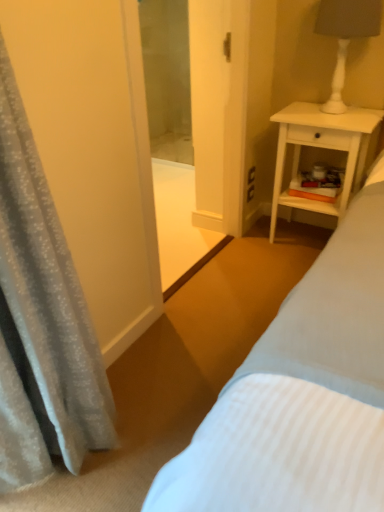
What do you see at coordinates (345, 36) in the screenshot? The image size is (384, 512). I see `white matte lamp at upper right` at bounding box center [345, 36].

What is the approximate height of silky gray curtain at left?

The height of silky gray curtain at left is 3.96 feet.

Locate an element on the screen. The width and height of the screenshot is (384, 512). transparent glass screen door at center is located at coordinates (218, 112).

Image resolution: width=384 pixels, height=512 pixels. I want to click on white wood nightstand at right, so click(x=322, y=148).

This screenshot has width=384, height=512. What do you see at coordinates (322, 148) in the screenshot?
I see `white wood nightstand at right` at bounding box center [322, 148].

The image size is (384, 512). I want to click on white matte lamp at upper right, so click(x=345, y=36).

Is transparent glass screen door at center next to white matte lamp at upper right and touching it?

No, transparent glass screen door at center is not next to white matte lamp at upper right.

Where is `bedside lamp behind the transparent glass screen door at center`? Image resolution: width=384 pixels, height=512 pixels. bedside lamp behind the transparent glass screen door at center is located at coordinates (345, 36).

From the image's perspective, which is above, transparent glass screen door at center or white matte lamp at upper right?

white matte lamp at upper right appears higher in the image.

From a real-world perspective, is silky gray curtain at left physically located above or below white matte lamp at upper right?

silky gray curtain at left is below white matte lamp at upper right.

Could you tell me if silky gray curtain at left is facing white matte lamp at upper right?

No, silky gray curtain at left is not aimed at white matte lamp at upper right.

Is silky gray curtain at left to the left of white matte lamp at upper right from the viewer's perspective?

Yes.

Is silky gray curtain at left taller or shorter than white matte lamp at upper right?

silky gray curtain at left is taller than white matte lamp at upper right.

Considering the positions of objects white wood nightstand at right and silky gray curtain at left in the image provided, who is more to the left, white wood nightstand at right or silky gray curtain at left?

Positioned to the left is silky gray curtain at left.

From the image's perspective, between white wood nightstand at right and silky gray curtain at left, which one is located above?

From the image's view, white wood nightstand at right is above.

Is white wood nightstand at right oriented towards silky gray curtain at left?

Yes, white wood nightstand at right is oriented towards silky gray curtain at left.

At what (x,y) coordinates should I click in order to perform the action: click on bedside lamp that is on the right side of transparent glass screen door at center. Please return your answer as a coordinate pair (x, y). The height and width of the screenshot is (512, 384). Looking at the image, I should click on (345, 36).

Can you confirm if white matte lamp at upper right is positioned to the right of transparent glass screen door at center?

Yes.

Is point (381, 9) more distant than point (238, 141)?

No, (381, 9) is closer to viewer.

Between white matte lamp at upper right and transparent glass screen door at center, which one has more height?

transparent glass screen door at center.

Considering the relative positions of silky gray curtain at left and transparent glass screen door at center in the image provided, is silky gray curtain at left to the left or to the right of transparent glass screen door at center?

Based on their positions, silky gray curtain at left is located to the left of transparent glass screen door at center.

Does silky gray curtain at left turn towards transparent glass screen door at center?

No.

The width and height of the screenshot is (384, 512). I want to click on screen door located above the silky gray curtain at left (from the image's perspective), so click(x=218, y=112).

Is silky gray curtain at left smaller than transparent glass screen door at center?

Actually, silky gray curtain at left might be larger than transparent glass screen door at center.

Can you confirm if transparent glass screen door at center is smaller than silky gray curtain at left?

Correct, transparent glass screen door at center occupies less space than silky gray curtain at left.

Is transparent glass screen door at center touching silky gray curtain at left?

No, transparent glass screen door at center is not beside silky gray curtain at left.

Can you tell me how much transparent glass screen door at center and silky gray curtain at left differ in facing direction?

The facing directions of transparent glass screen door at center and silky gray curtain at left are 3.49 degrees apart.

Considering the relative positions of white matte lamp at upper right and white wood nightstand at right in the image provided, is white matte lamp at upper right in front of white wood nightstand at right?

Yes, it is.

From a real-world perspective, is white matte lamp at upper right over white wood nightstand at right?

Correct, in the physical world, white matte lamp at upper right is higher than white wood nightstand at right.

Which is behind, point (371, 13) or point (278, 146)?

Positioned behind is point (278, 146).

In terms of size, does white matte lamp at upper right appear bigger or smaller than white wood nightstand at right?

Considering their sizes, white matte lamp at upper right takes up less space than white wood nightstand at right.

Where is `screen door below the white matte lamp at upper right (from a real-world perspective)`? screen door below the white matte lamp at upper right (from a real-world perspective) is located at coordinates (218, 112).

Image resolution: width=384 pixels, height=512 pixels. Find the location of `curtain in front of the white matte lamp at upper right`. curtain in front of the white matte lamp at upper right is located at coordinates (41, 320).

Considering their positions, is white matte lamp at upper right positioned closer to silky gray curtain at left than transparent glass screen door at center?

Based on the image, transparent glass screen door at center appears to be nearer to silky gray curtain at left.

From the image, which object appears to be nearer to white wood nightstand at right, transparent glass screen door at center or silky gray curtain at left?

Among the two, transparent glass screen door at center is located nearer to white wood nightstand at right.

Based on their spatial positions, is silky gray curtain at left or transparent glass screen door at center further from white wood nightstand at right?

The object further to white wood nightstand at right is silky gray curtain at left.

Based on their spatial positions, is white matte lamp at upper right or white wood nightstand at right further from silky gray curtain at left?

white matte lamp at upper right lies further to silky gray curtain at left than the other object.

Which object lies nearer to the anchor point transparent glass screen door at center, white wood nightstand at right or silky gray curtain at left?

Based on the image, white wood nightstand at right appears to be nearer to transparent glass screen door at center.

From the image, which object appears to be farther from white matte lamp at upper right, white wood nightstand at right or silky gray curtain at left?

silky gray curtain at left.

Considering their positions, is silky gray curtain at left positioned further to transparent glass screen door at center than white matte lamp at upper right?

silky gray curtain at left lies further to transparent glass screen door at center than the other object.

Which object lies nearer to the anchor point white matte lamp at upper right, transparent glass screen door at center or white wood nightstand at right?

Based on the image, white wood nightstand at right appears to be nearer to white matte lamp at upper right.

The height and width of the screenshot is (512, 384). I want to click on screen door between silky gray curtain at left and white wood nightstand at right from front to back, so click(x=218, y=112).

At what (x,y) coordinates should I click in order to perform the action: click on bedside lamp located between silky gray curtain at left and white wood nightstand at right in the depth direction. Please return your answer as a coordinate pair (x, y). Looking at the image, I should click on (345, 36).

This screenshot has width=384, height=512. I want to click on nightstand situated between transparent glass screen door at center and white matte lamp at upper right from left to right, so click(322, 148).

Locate an element on the screen. The height and width of the screenshot is (512, 384). screen door located between silky gray curtain at left and white matte lamp at upper right in the depth direction is located at coordinates (218, 112).